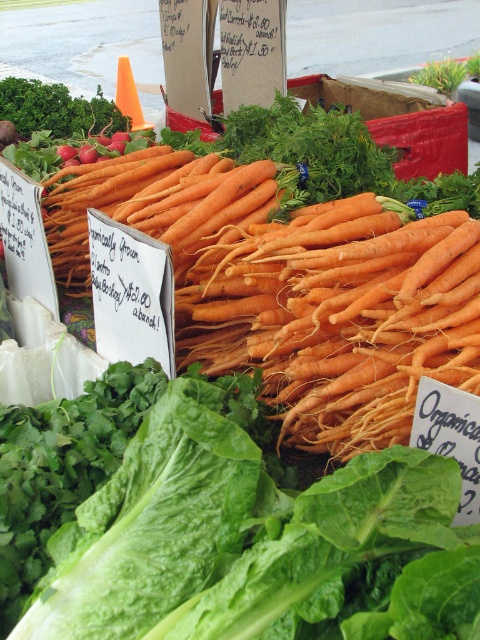
You are standing at the market stall and want to reach a specific point in the image. The point is located at coordinates point (192,506). If your arm can reach up to 30 inches, will you be able to reach that point without moving closer?

The distance of point (192,506) from camera is 35.26 inches, so you cannot reach it with an arm length of 30 inches. You need to move closer.

You are a customer at the market stall looking at the vegetables. You see the green leafy at center and the green leafy at upper left. Which one is closer to you?

The green leafy at center is closer to you because it is positioned under the green leafy at upper left, meaning it is in front of the other one.